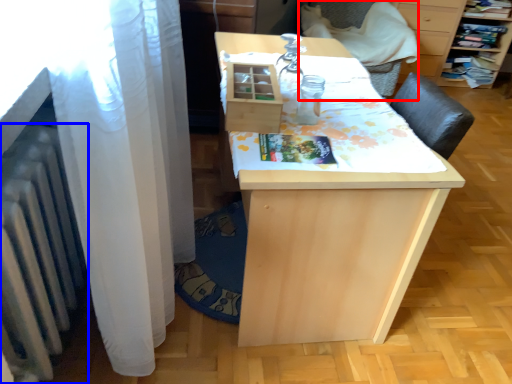
Question: Which point is closer to the camera, armchair (highlighted by a red box) or radiator (highlighted by a blue box)?

Choices:
 (A) armchair
 (B) radiator

Answer: (B)